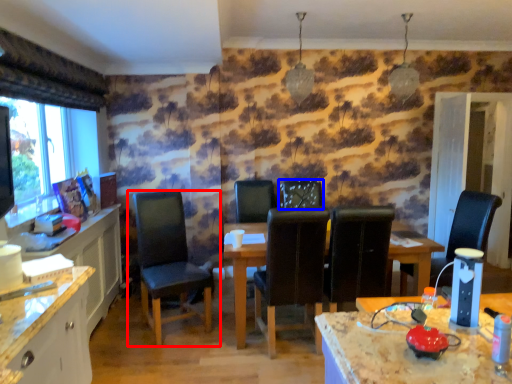
Question: Which of the following is the closest to the observer, chair (highlighted by a red box) or chair (highlighted by a blue box)?

Choices:
 (A) chair
 (B) chair

Answer: (A)